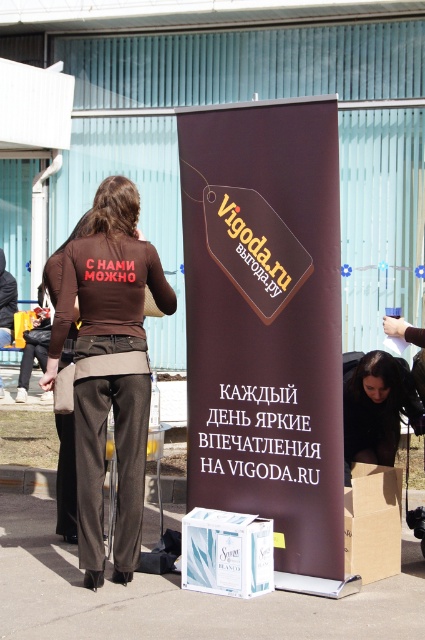
You are at an event and need to place a new sign on the ground next to the brown cardboard box at lower right. Can you see the brown matte banner at center from that position?

Yes, because the brown matte banner at center is above the brown cardboard box at lower right, so it should be visible from the ground next to the box.

You are organizing an event and need to place a new decorative item between the brown matte banner at center and the white glossy box at lower center. Considering their sizes, which object should the new item be placed closer to?

The new decorative item should be placed closer to the white glossy box at lower center because the brown matte banner at center is larger in size and thus requires more space around it.